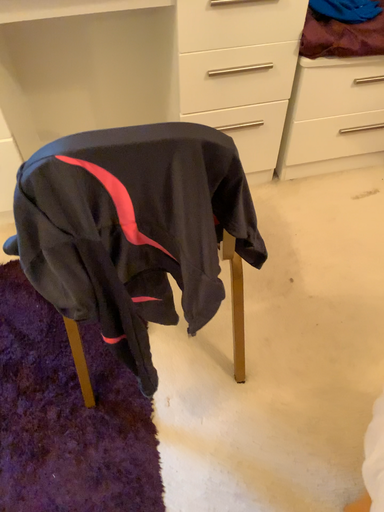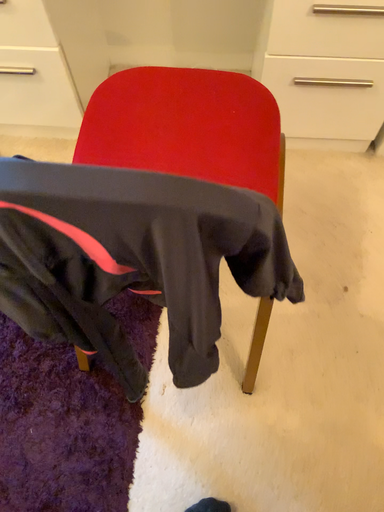
Question: Which way did the camera rotate in the video?

Choices:
 (A) rotated downward
 (B) rotated upward

Answer: (A)